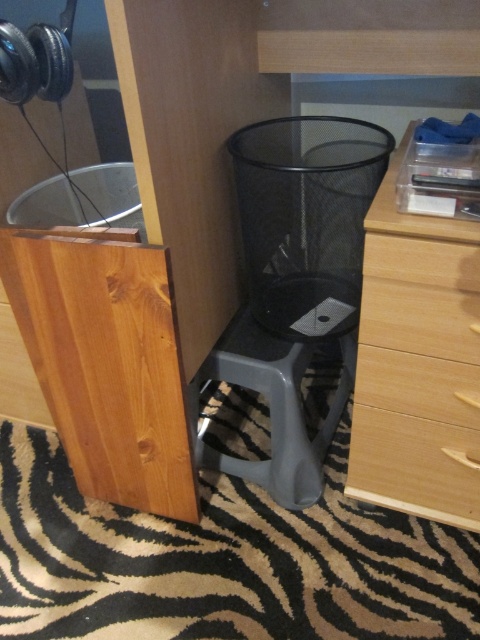
Does gray plastic stool at center have a greater height compared to light brown wood drawer at lower right?

Yes, gray plastic stool at center is taller than light brown wood drawer at lower right.

Who is higher up, gray plastic stool at center or light brown wood drawer at lower right?

gray plastic stool at center is higher up.

Describe the element at coordinates (274, 408) in the screenshot. I see `gray plastic stool at center` at that location.

You are a GUI agent. You are given a task and a screenshot of the screen. Output one action in this format:
    pyautogui.click(x=<x>, y=<y>)
    Task: Click on the gray plastic stool at center
    The height and width of the screenshot is (640, 480).
    Given the screenshot: What is the action you would take?
    pyautogui.click(x=274, y=408)

Is wooden dresser at center bigger than light brown wood drawer at lower right?

Correct, wooden dresser at center is larger in size than light brown wood drawer at lower right.

Between point (391, 227) and point (355, 451), which one is positioned in front?

Point (391, 227) is more forward.

Locate an element on the screen. This screenshot has width=480, height=640. wooden dresser at center is located at coordinates (418, 364).

Does light brown wood drawer at lower right have a smaller size compared to wooden drawer at lower right?

No.

Is light brown wood drawer at lower right to the right of wooden drawer at lower right from the viewer's perspective?

Yes, light brown wood drawer at lower right is to the right of wooden drawer at lower right.

Locate an element on the screen. This screenshot has width=480, height=640. light brown wood drawer at lower right is located at coordinates (415, 467).